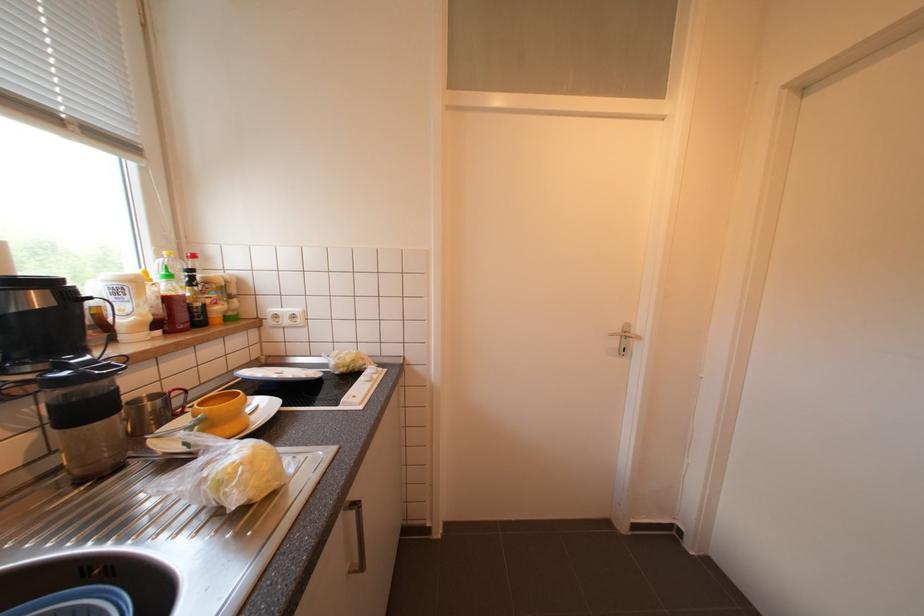
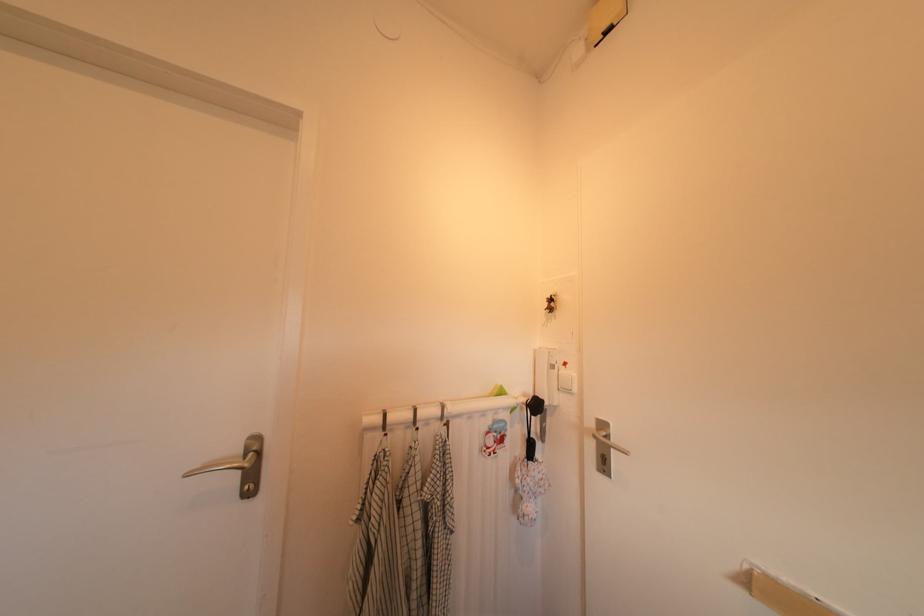
Question: The images are taken continuously from a first-person perspective. In which direction is your viewpoint rotating?

Choices:
 (A) Left
 (B) Right
 (C) Up
 (D) Down

Answer: (B)